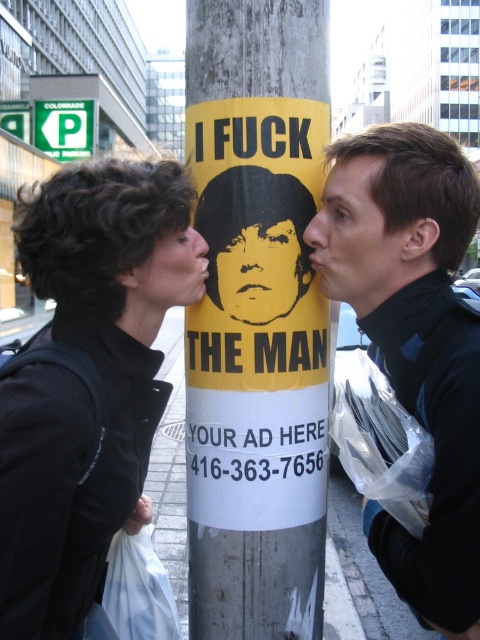
You are a photographer trying to capture a candid shot of the two people near the pole. The camera you are using has a maximum focus range of 24 inches. Can you fit both the black matte jacket at left and the black matte jacket at right in the frame without moving your position?

The distance between the black matte jacket at left and the black matte jacket at right is 24.11 inches. Since the camera can only focus up to 24 inches, the photographer cannot fit both jackets in the frame without moving closer or adjusting the focus range.